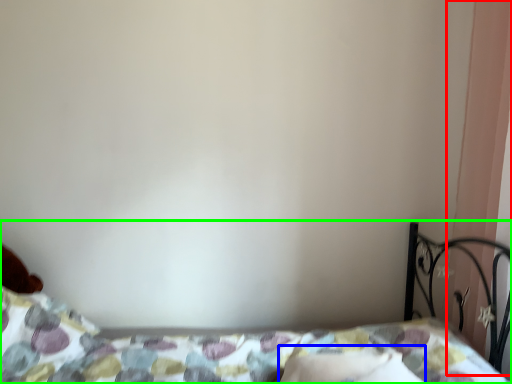
Question: Estimate the real-world distances between objects in this image. Which object is farther from curtain (highlighted by a red box), pillow (highlighted by a blue box) or bed (highlighted by a green box)?

Choices:
 (A) pillow
 (B) bed

Answer: (B)